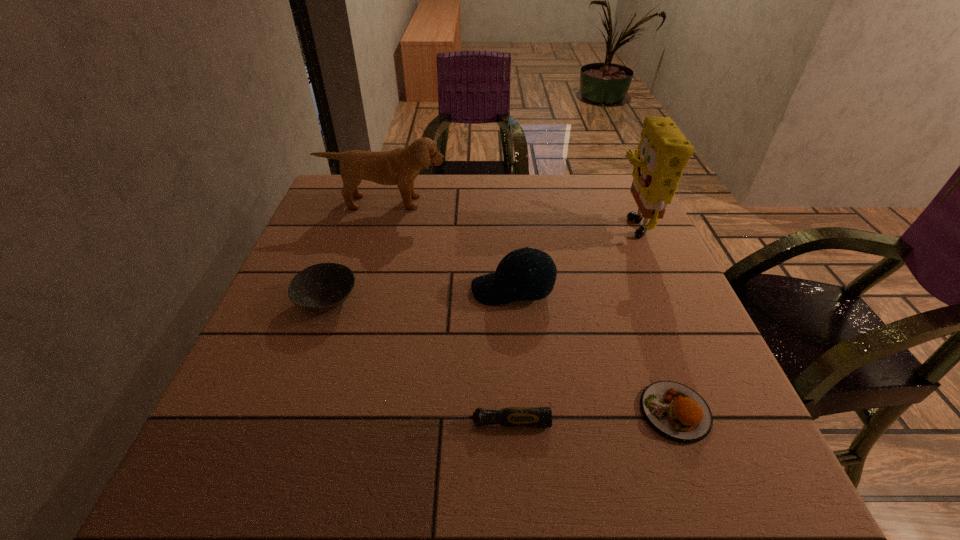
Locate an element on the screen. Image resolution: width=960 pixels, height=540 pixels. sponge is located at coordinates (663, 152).

At what (x,y) coordinates should I click in order to perform the action: click on the fifth shortest object. Please return your answer as a coordinate pair (x, y). Looking at the image, I should click on (400, 166).

Find the location of a particular element. The image size is (960, 540). the fourth shortest object is located at coordinates (512, 281).

Where is `the fourth tallest object`? The height and width of the screenshot is (540, 960). the fourth tallest object is located at coordinates (321, 287).

Identify the location of the fifth tallest object. (675, 411).

The width and height of the screenshot is (960, 540). Find the location of `screwdriver`. screwdriver is located at coordinates (515, 417).

You are a GUI agent. You are given a task and a screenshot of the screen. Output one action in this format:
    pyautogui.click(x=<x>, y=<y>)
    Task: Click on the free space located on the face of the tallest object
    The height and width of the screenshot is (540, 960).
    Given the screenshot: What is the action you would take?
    pyautogui.click(x=562, y=222)

What are the coordinates of `vacant space located 0.100m on the face of the tallest object` in the screenshot? It's located at (573, 222).

This screenshot has height=540, width=960. I want to click on vacant space located 0.250m on the face of the tallest object, so click(x=516, y=222).

Where is `vacant region located 0.200m on the left side of the puppy`? vacant region located 0.200m on the left side of the puppy is located at coordinates (369, 259).